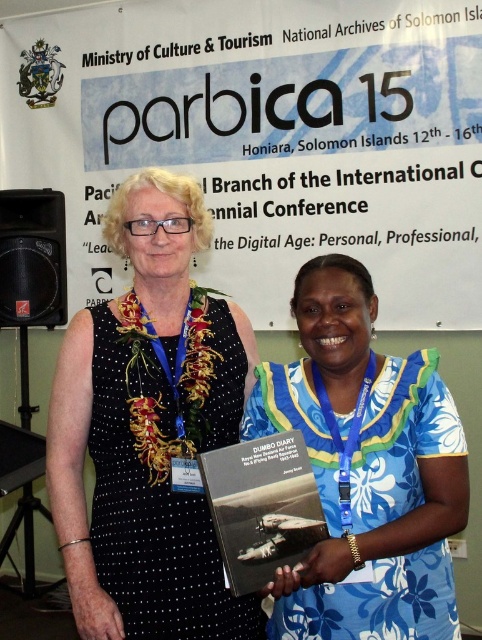
Question: Which object appears closest to the camera in this image?

Choices:
 (A) black plastic speaker at left
 (B) white paper at upper center
 (C) black dotted dress at left
 (D) blue floral dress at center

Answer: (D)

Question: Observing the image, what is the correct spatial positioning of white paper at upper center in reference to blue floral dress at center?

Choices:
 (A) above
 (B) below

Answer: (A)

Question: Does white paper at upper center appear on the right side of black dotted dress at left?

Choices:
 (A) no
 (B) yes

Answer: (B)

Question: Among these objects, which one is nearest to the camera?

Choices:
 (A) black dotted dress at left
 (B) blue floral dress at center

Answer: (B)

Question: Among these points, which one is nearest to the camera?

Choices:
 (A) (285, 378)
 (B) (59, 195)
 (C) (327, 122)

Answer: (A)

Question: Does white paper at upper center appear on the left side of matte black book at center?

Choices:
 (A) no
 (B) yes

Answer: (B)